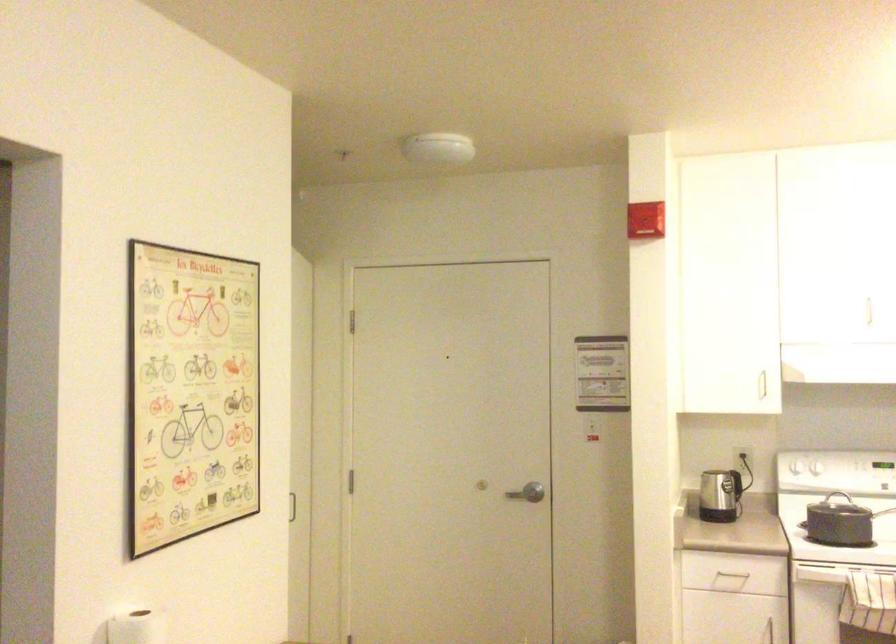
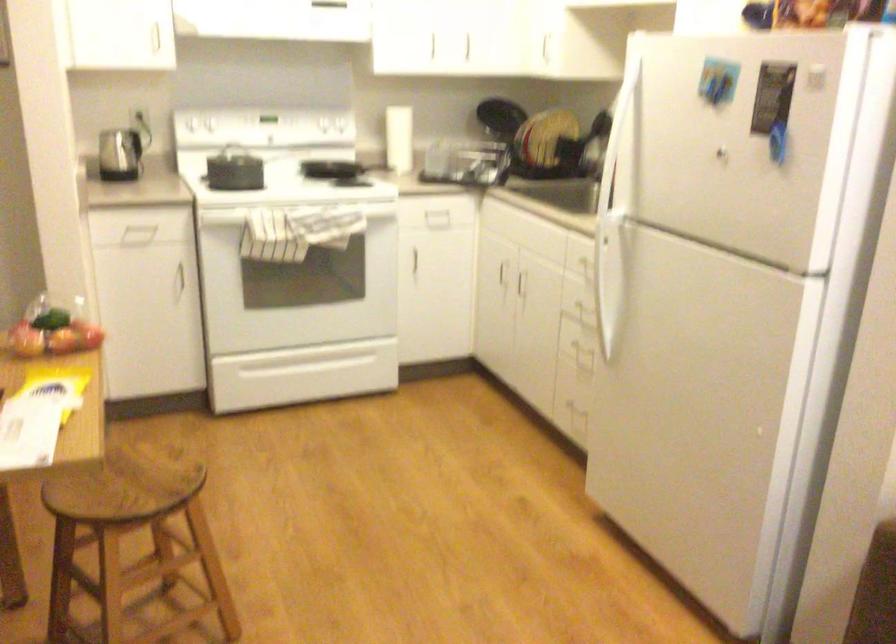
Find the pixel in the second image that matches the point at 729,383 in the first image.

(119, 35)